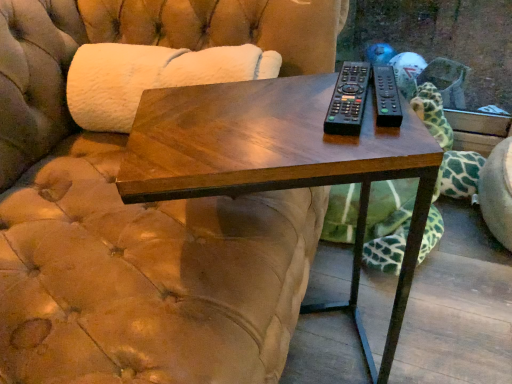
The width and height of the screenshot is (512, 384). Find the location of `free space to the left of black plastic remote at center, the first remote when ordered from left to right`. free space to the left of black plastic remote at center, the first remote when ordered from left to right is located at coordinates (249, 116).